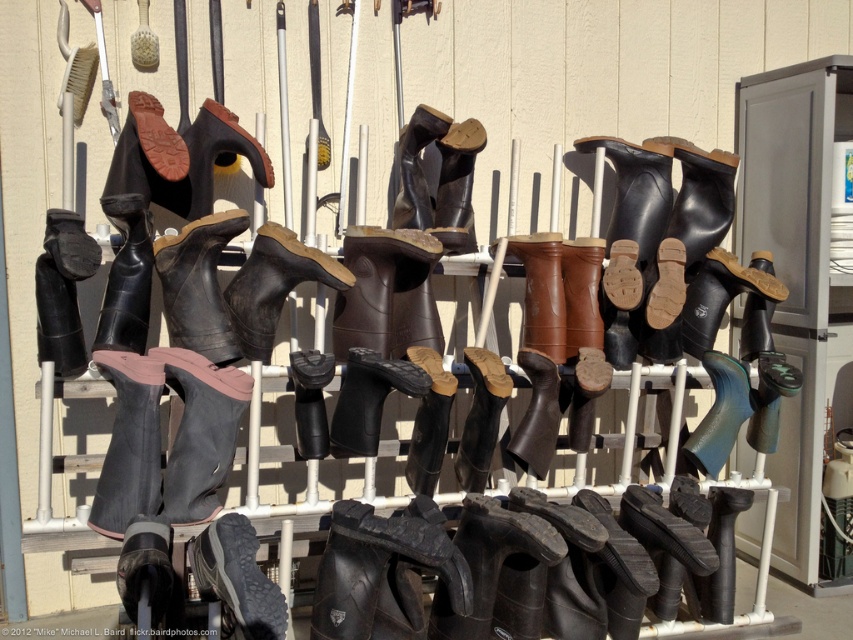
Identify the location of gray rubber shoe at lower center. (236, 577).

Is gray rubber shoe at lower center closer to the viewer compared to shiny black boot at lower left?

That is True.

Find the location of `gray rubber shoe at lower center`. gray rubber shoe at lower center is located at coordinates (236, 577).

This screenshot has width=853, height=640. Find the location of `gray rubber shoe at lower center`. gray rubber shoe at lower center is located at coordinates (236, 577).

Is rubber/matte boot at center above shiny black boot at lower left?

Correct, rubber/matte boot at center is located above shiny black boot at lower left.

Between point (308, 268) and point (125, 548), which one is positioned in front?

Point (125, 548) is in front.

Identify the location of rubber/matte boot at center. (x=274, y=285).

Does rubber/matte boot at center appear under brown matte boot at upper left?

Correct, rubber/matte boot at center is located below brown matte boot at upper left.

Does rubber/matte boot at center have a larger size compared to brown matte boot at upper left?

Yes, rubber/matte boot at center is bigger than brown matte boot at upper left.

You are a GUI agent. You are given a task and a screenshot of the screen. Output one action in this format:
    pyautogui.click(x=<x>, y=<y>)
    Task: Click on the rubber/matte boot at center
    This screenshot has height=640, width=853.
    Given the screenshot: What is the action you would take?
    pyautogui.click(x=274, y=285)

The height and width of the screenshot is (640, 853). Find the location of `rubber/matte boot at center`. rubber/matte boot at center is located at coordinates (274, 285).